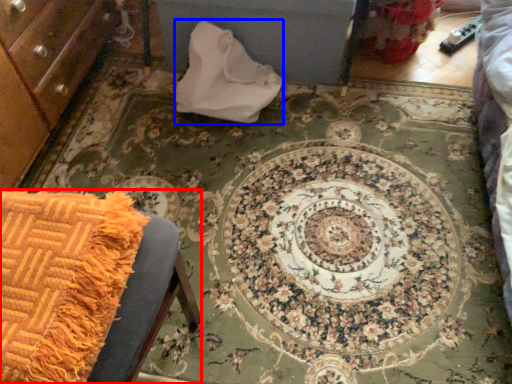
Question: Which object appears closest to the camera in this image, furniture (highlighted by a red box) or material (highlighted by a blue box)?

Choices:
 (A) furniture
 (B) material

Answer: (A)